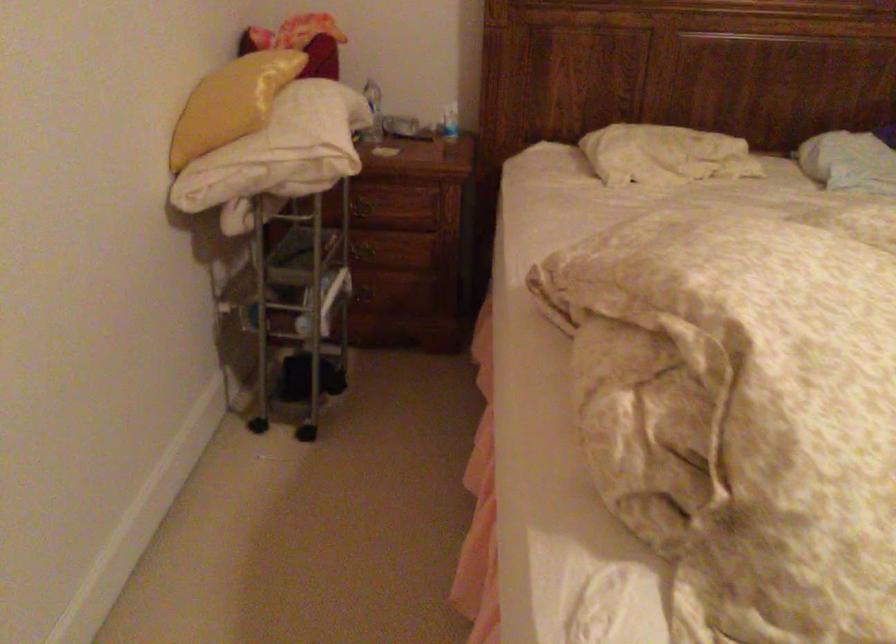
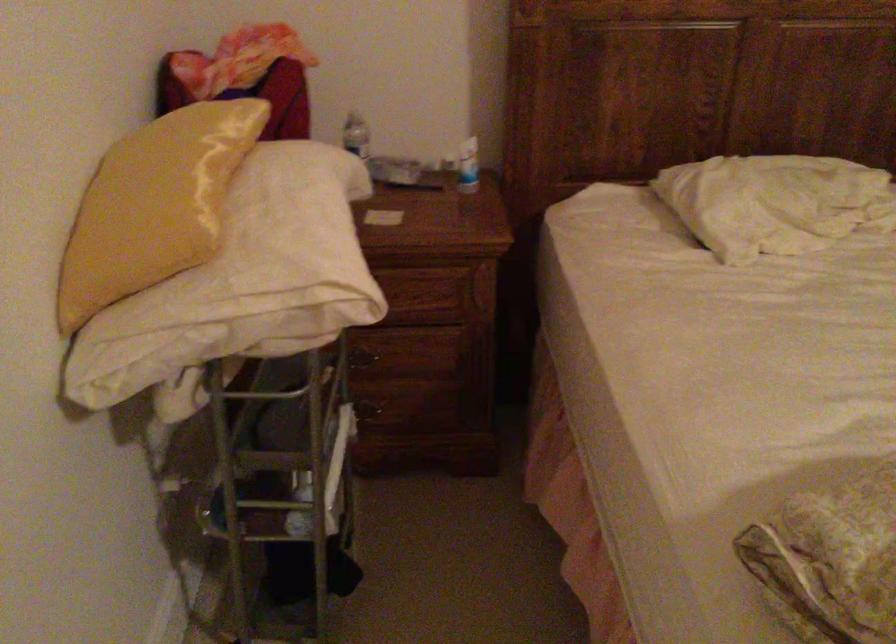
Locate, in the second image, the point that corresponds to (658,151) in the first image.

(774, 202)